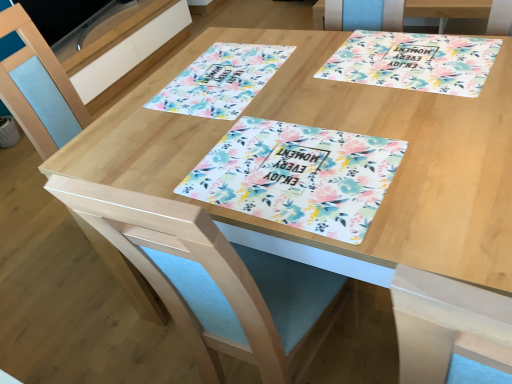
I want to click on free spot behind floral paper placemat at center, positioned as the 1th flyer in front-to-back order, so click(x=286, y=104).